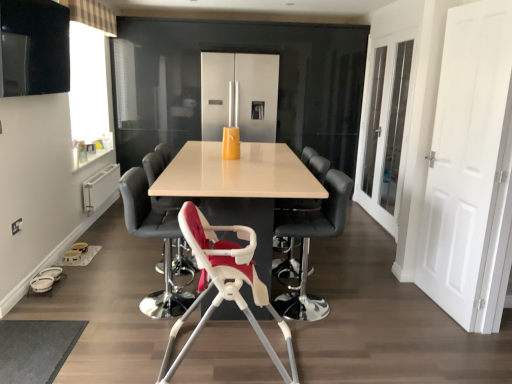
Find the location of a particular element. The width and height of the screenshot is (512, 384). vacant space that is in between white matte door at right and black leather chair at center, the first chair when ordered from back to front is located at coordinates (378, 289).